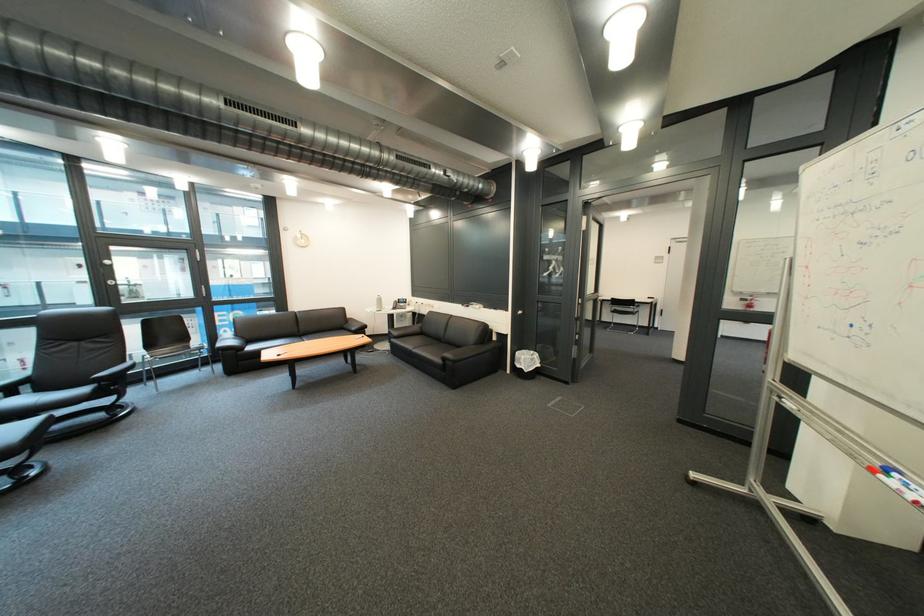
This screenshot has width=924, height=616. Identify the location of telephone handset. (907, 325).